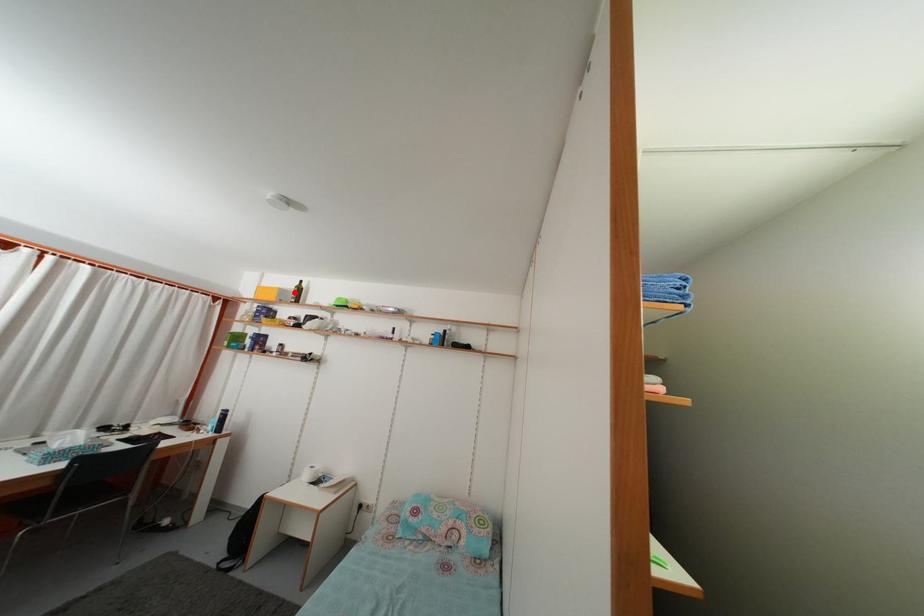
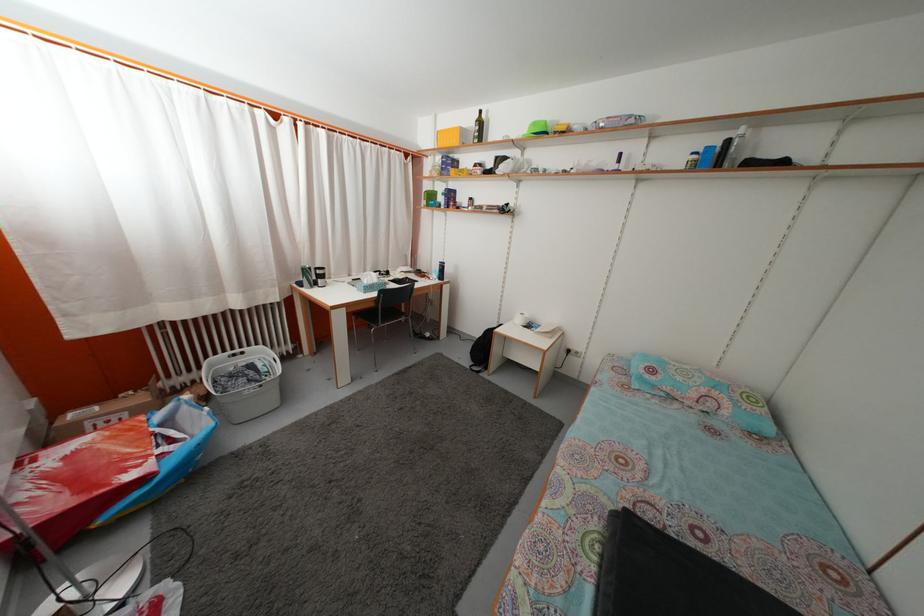
Question: I am providing you with two images of the same scene from different viewpoints. Given a red point in image1, look at the same physical point in image2. Is it:

Choices:
 (A) Closer to the viewpoint
 (B) Farther from the viewpoint

Answer: (A)